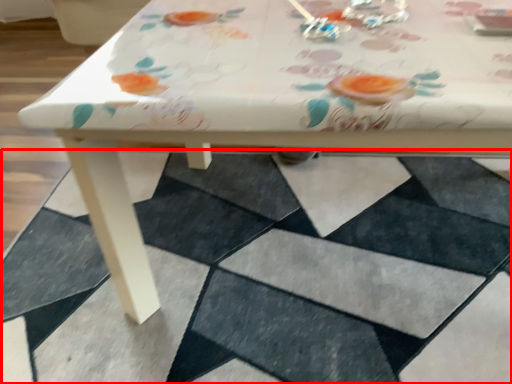
Question: Where is square (annotated by the red box) located in relation to tableware in the image?

Choices:
 (A) left
 (B) right

Answer: (A)